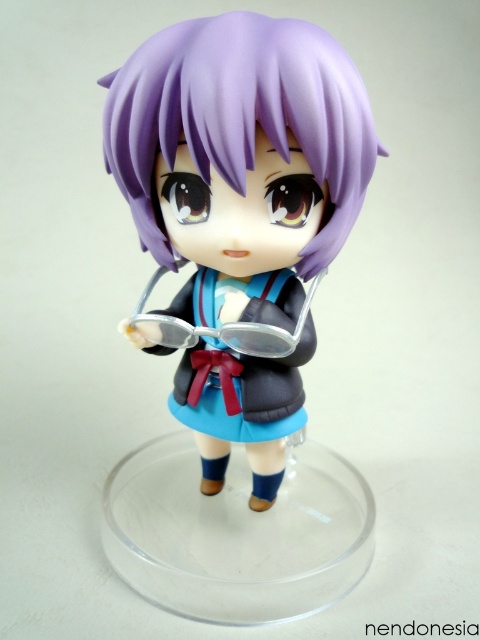
You are an artist trying to draw the character from the image. You want to ensure the proportions are accurate. Which object should you draw first, the matte purple hair at center or the matte plastic school uniform at center, to maintain proper scaling?

You should draw the matte plastic school uniform at center first because the matte purple hair at center is wider than the uniform, so starting with the smaller object ensures the larger one fits correctly.